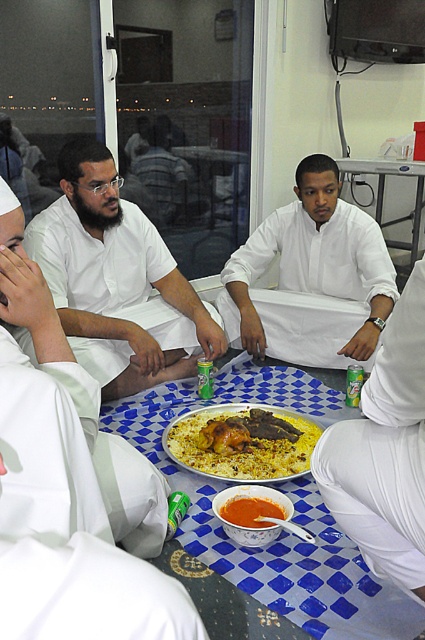
Between point (147, 364) and point (237, 506), which one is positioned behind?

Point (147, 364)

Does point (127, 227) come closer to viewer compared to point (246, 497)?

No, (127, 227) is behind (246, 497).

Which is behind, point (138, 358) or point (246, 509)?

The point (138, 358) is behind.

Identify the location of matte white shirt at center. This screenshot has height=640, width=425. (116, 278).

The width and height of the screenshot is (425, 640). What do you see at coordinates (311, 275) in the screenshot? I see `white matte shirt at center` at bounding box center [311, 275].

Is point (374, 282) more distant than point (215, 496)?

Yes, it is.

Identify the location of white matte shirt at center. (311, 275).

Who is higher up, white matte robe at lower left or blue checkered table at center?

blue checkered table at center

Image resolution: width=425 pixels, height=640 pixels. What are the coordinates of `white matte robe at lower left` in the screenshot? It's located at (88, 593).

The width and height of the screenshot is (425, 640). I want to click on white matte robe at lower left, so click(88, 593).